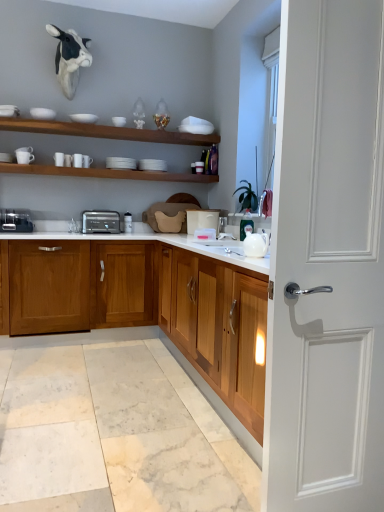
Question: Does white matte door at right appear on the right side of white ceramic cup at left, positioned as the second tableware in bottom-to-top order?

Choices:
 (A) yes
 (B) no

Answer: (A)

Question: Can you confirm if white matte door at right is bigger than white ceramic cup at left, which appears as the 4th tableware when viewed from the top?

Choices:
 (A) no
 (B) yes

Answer: (B)

Question: Could white ceramic cup at left, the 3th tableware when ordered from left to right, be considered to be inside white matte door at right?

Choices:
 (A) no
 (B) yes

Answer: (A)

Question: Is white matte door at right next to white ceramic cup at left, positioned as the 3th tableware in right-to-left order?

Choices:
 (A) no
 (B) yes

Answer: (A)

Question: Considering the relative sizes of white matte door at right and white ceramic cup at left, positioned as the 3th tableware in right-to-left order, in the image provided, is white matte door at right taller than white ceramic cup at left, positioned as the 3th tableware in right-to-left order,?

Choices:
 (A) yes
 (B) no

Answer: (A)

Question: Looking at their shapes, would you say wooden cabinets at center is wider or thinner than wooden shelf at upper center, arranged as the 1th shelf when ordered from the bottom?

Choices:
 (A) thin
 (B) wide

Answer: (B)

Question: Is wooden cabinets at center bigger or smaller than wooden shelf at upper center, arranged as the 1th shelf when ordered from the bottom?

Choices:
 (A) big
 (B) small

Answer: (A)

Question: Is point (43, 309) positioned closer to the camera than point (49, 165)?

Choices:
 (A) closer
 (B) farther

Answer: (A)

Question: Is wooden cabinets at center taller or shorter than wooden shelf at upper center, which is the 2th shelf from top to bottom?

Choices:
 (A) tall
 (B) short

Answer: (A)

Question: From a real-world perspective, relative to white plastic container at center, the 1th appliance when ordered from right to left, is wooden shelf at upper center, arranged as the 1th shelf when ordered from the bottom, vertically above or below?

Choices:
 (A) below
 (B) above

Answer: (B)

Question: Considering their positions, is wooden shelf at upper center, which is the 2th shelf from top to bottom, located in front of or behind white plastic container at center, the 1th appliance when ordered from right to left?

Choices:
 (A) front
 (B) behind

Answer: (A)

Question: From their relative heights in the image, would you say wooden shelf at upper center, which is the 2th shelf from top to bottom, is taller or shorter than white plastic container at center, the 1th appliance when ordered from right to left?

Choices:
 (A) short
 (B) tall

Answer: (A)

Question: Looking at their shapes, would you say wooden shelf at upper center, arranged as the 1th shelf when ordered from the bottom, is wider or thinner than white plastic container at center, the 1th appliance when ordered from right to left?

Choices:
 (A) wide
 (B) thin

Answer: (A)

Question: Considering the positions of white matte bowl at upper center, the fourth tableware from the bottom, and white matte cow head at upper left in the image, is white matte bowl at upper center, the fourth tableware from the bottom, wider or thinner than white matte cow head at upper left?

Choices:
 (A) wide
 (B) thin

Answer: (B)

Question: Is white matte bowl at upper center, acting as the fourth tableware starting from the left, inside or outside of white matte cow head at upper left?

Choices:
 (A) inside
 (B) outside

Answer: (B)